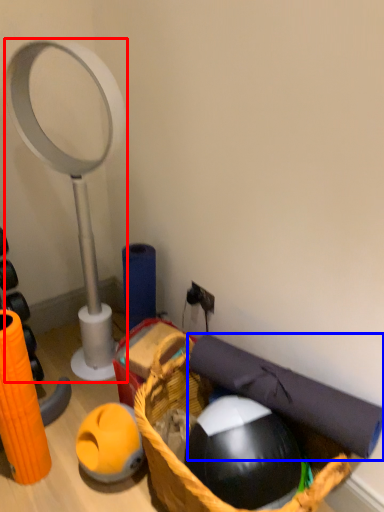
Question: Which object is closer to the camera taking this photo, magnifying glass (highlighted by a red box) or yoga mat (highlighted by a blue box)?

Choices:
 (A) magnifying glass
 (B) yoga mat

Answer: (B)